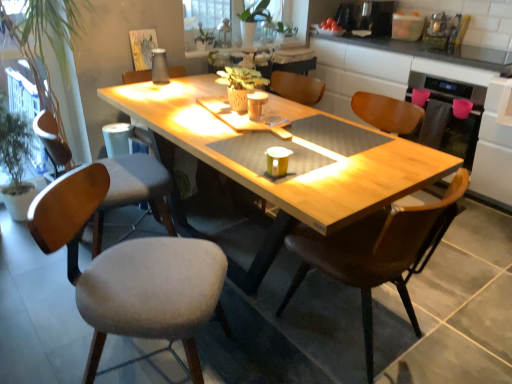
Identify the location of vacant location behind yellow matte coffee cup at center, which is the first coffee cup in bottom-to-top order. (289, 158).